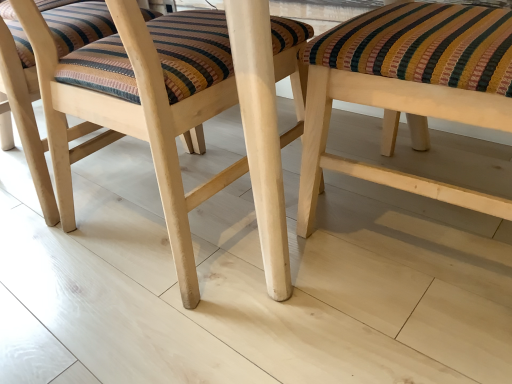
You are a GUI agent. You are given a task and a screenshot of the screen. Output one action in this format:
    pyautogui.click(x=<x>, y=<y>)
    Task: Click on the vacant area that is in front of natural wood stool at center, the 2th stool from the right
    The image size is (512, 384).
    Given the screenshot: What is the action you would take?
    pyautogui.click(x=209, y=322)